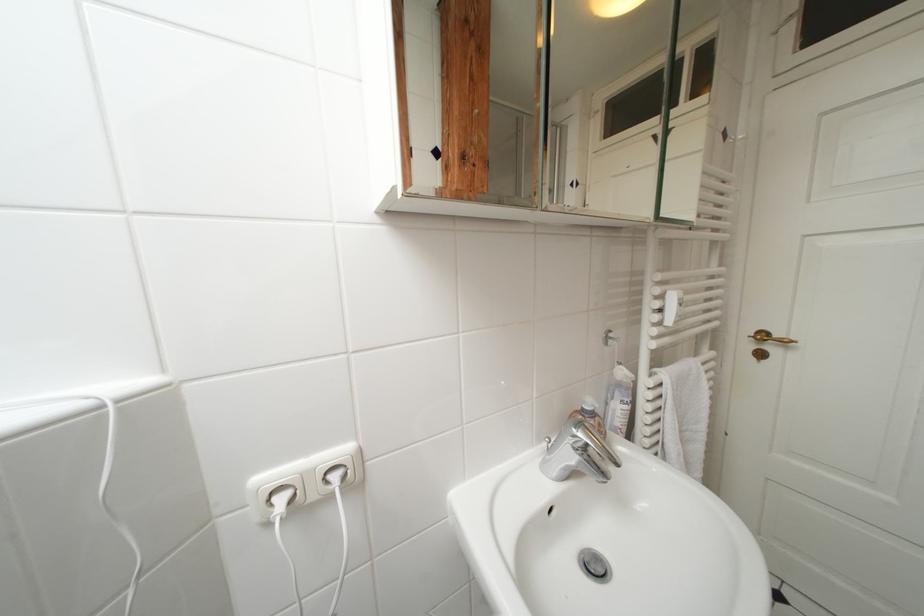
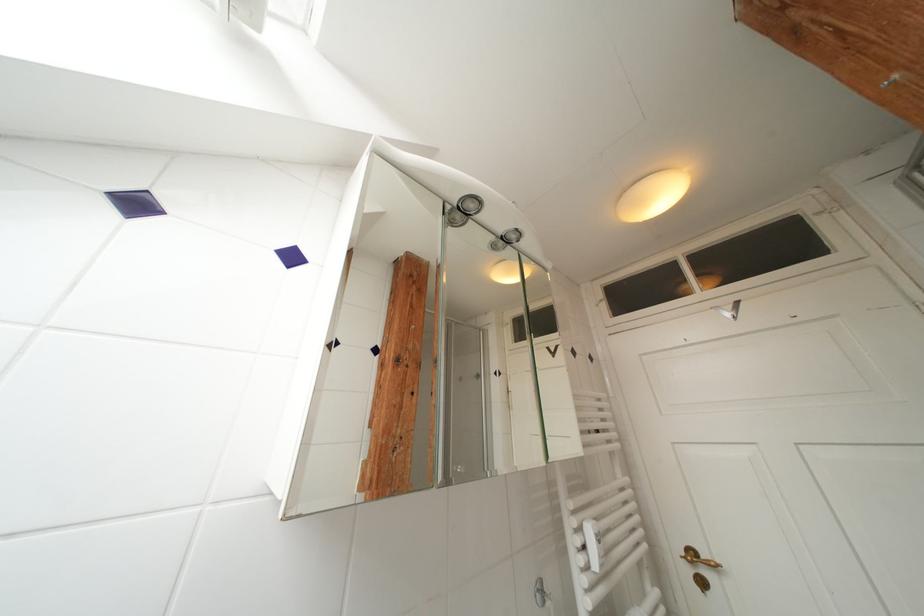
Find the pixel in the second image that matches pixel 578 188 in the first image.

(502, 377)